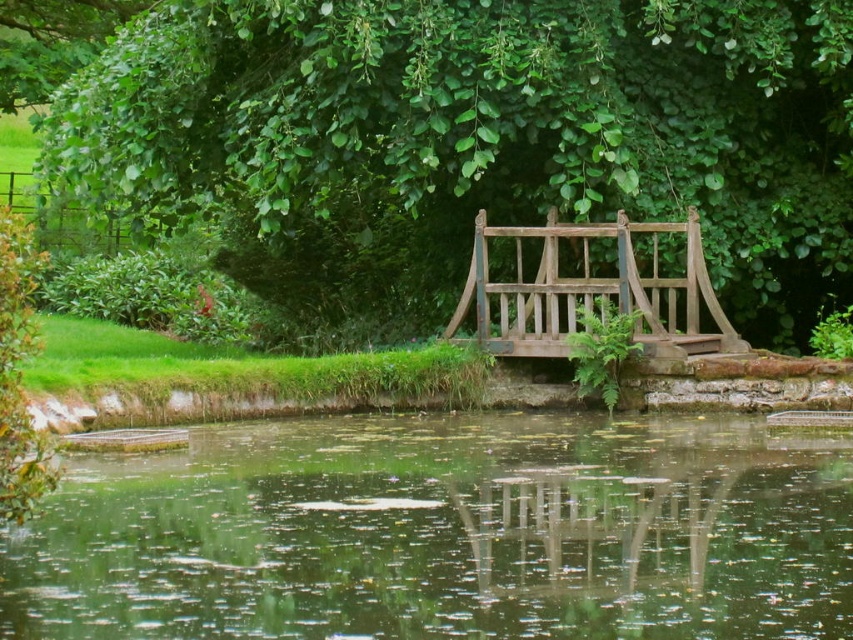
Is green leafy tree at center to the right of wooden park bench at center from the viewer's perspective?

Incorrect, green leafy tree at center is not on the right side of wooden park bench at center.

Does green leafy tree at center have a greater width compared to wooden park bench at center?

Yes, green leafy tree at center is wider than wooden park bench at center.

You are a GUI agent. You are given a task and a screenshot of the screen. Output one action in this format:
    pyautogui.click(x=<x>, y=<y>)
    Task: Click on the green leafy tree at center
    The image size is (853, 640).
    Given the screenshot: What is the action you would take?
    pyautogui.click(x=456, y=134)

Looking at this image, between green leafy tree at center and green reflective water at center, which one is positioned higher?

green leafy tree at center is higher up.

Is point (427, 241) closer to viewer compared to point (469, 451)?

No, it is not.

Measure the distance between green leafy tree at center and camera.

They are 15.96 meters apart.

Where is `green leafy tree at center`? The height and width of the screenshot is (640, 853). green leafy tree at center is located at coordinates (456, 134).

Is green reflective water at center in front of wooden park bench at center?

Yes, green reflective water at center is closer to the viewer.

At what (x,y) coordinates should I click in order to perform the action: click on green reflective water at center. Please return your answer as a coordinate pair (x, y). The width and height of the screenshot is (853, 640). Looking at the image, I should click on (445, 532).